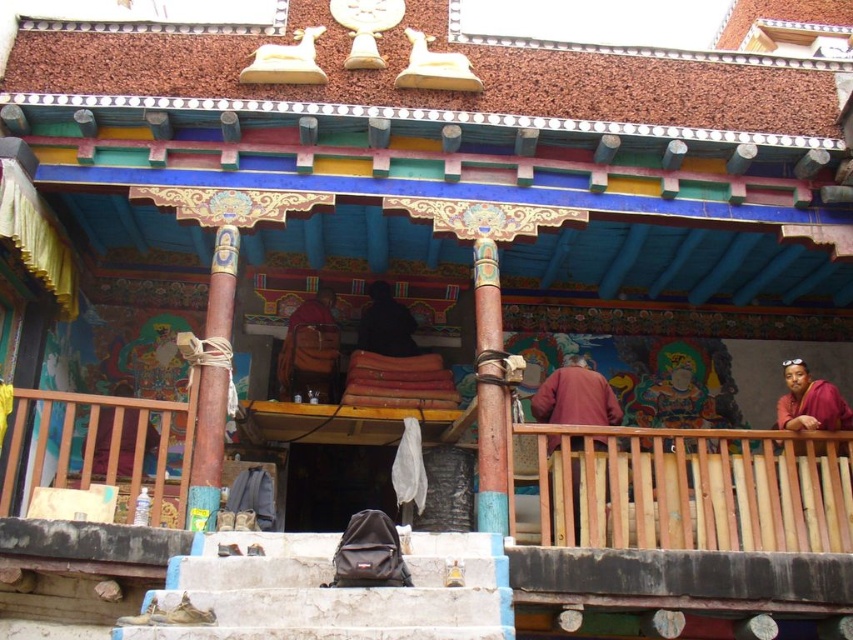
Question: Which point appears farthest from the camera in this image?

Choices:
 (A) 299,563
 (B) 576,436

Answer: (B)

Question: Can you confirm if white stone stairs at lower center is positioned above maroon woolen robe at center?

Choices:
 (A) no
 (B) yes

Answer: (A)

Question: Which point is farther to the camera?

Choices:
 (A) (322, 580)
 (B) (547, 384)

Answer: (B)

Question: Observing the image, what is the correct spatial positioning of white stone stairs at lower center in reference to maroon woolen robe at center?

Choices:
 (A) left
 (B) right

Answer: (A)

Question: Can you confirm if white stone stairs at lower center is positioned to the right of maroon woolen robe at center?

Choices:
 (A) yes
 (B) no

Answer: (B)